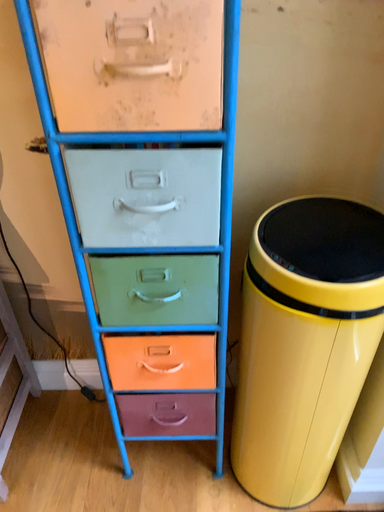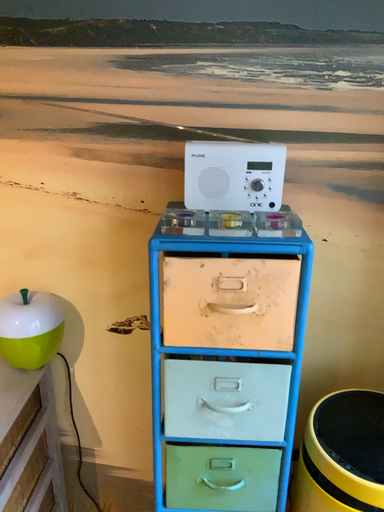
Question: How did the camera likely rotate when shooting the video?

Choices:
 (A) rotated upward
 (B) rotated downward

Answer: (A)